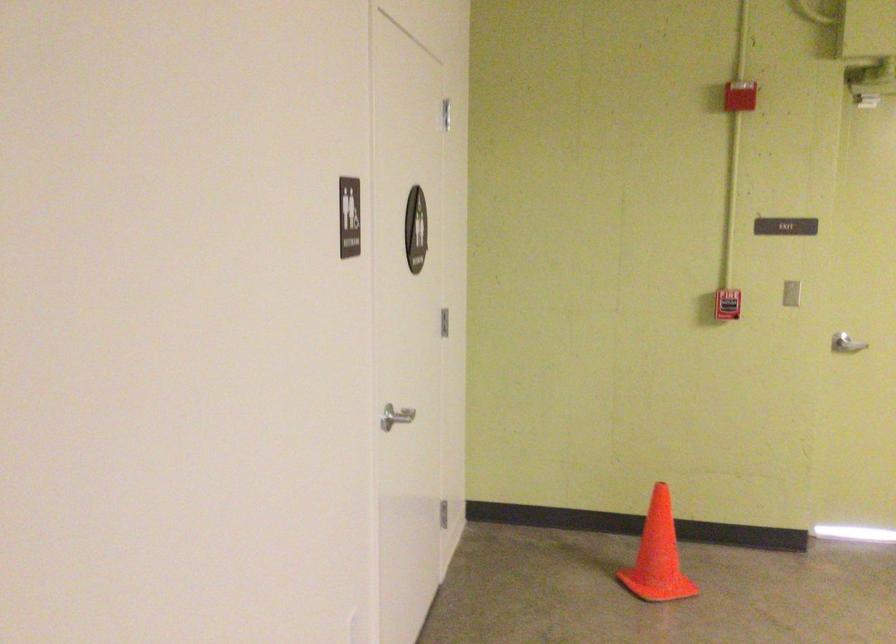
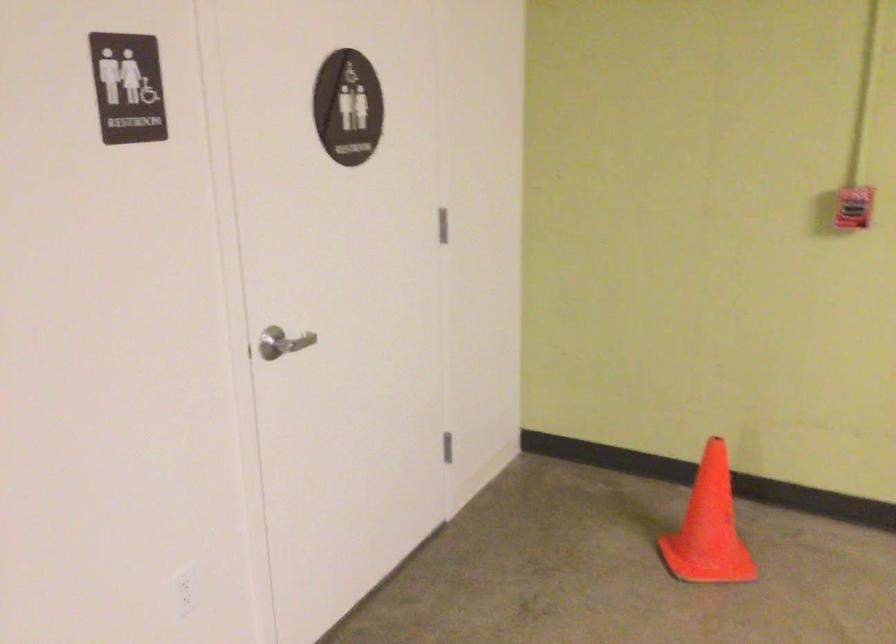
Question: Based on the continuous images, in which direction is the camera rotating? Reply with the corresponding letter.

Choices:
 (A) Left
 (B) Right
 (C) Up
 (D) Down

Answer: (A)